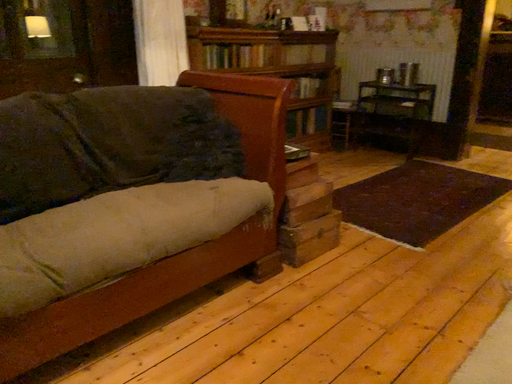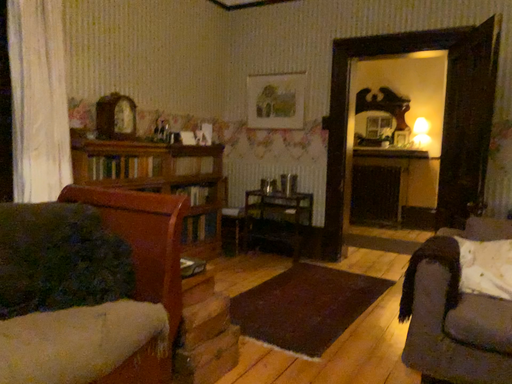
Question: Which way did the camera rotate in the video?

Choices:
 (A) rotated left
 (B) rotated right

Answer: (B)